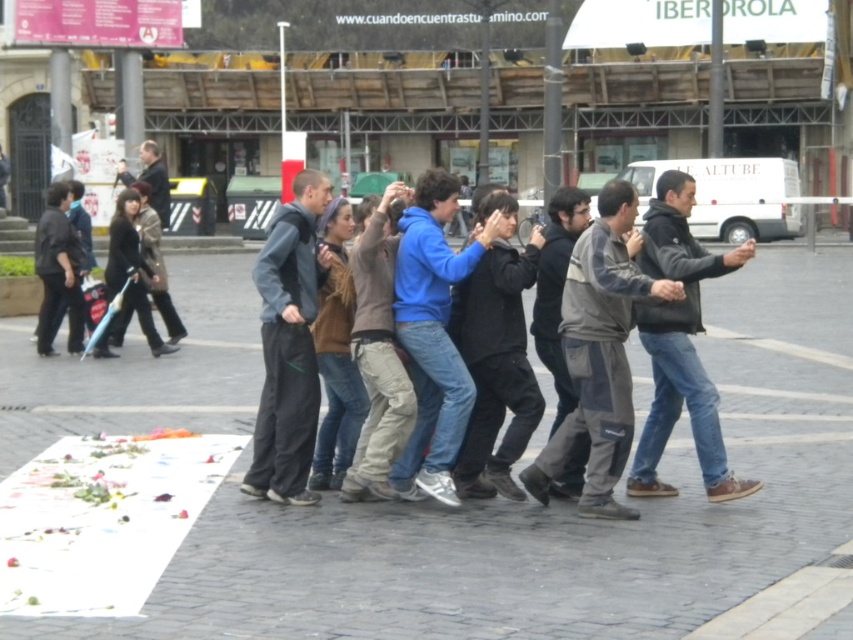
Question: Does cobblestone pavement at center have a lesser width compared to gray fabric jacket at center?

Choices:
 (A) yes
 (B) no

Answer: (B)

Question: Observing the image, what is the correct spatial positioning of cobblestone pavement at center in reference to dark gray hoodie at center?

Choices:
 (A) below
 (B) above

Answer: (B)

Question: Which of the following is the closest to the observer?

Choices:
 (A) dark gray hoodie at center
 (B) dark gray pants at center
 (C) dark brown leather jacket at left
 (D) brown cotton hoodie at center

Answer: (A)

Question: Which object is farther from the camera taking this photo?

Choices:
 (A) cobblestone pavement at center
 (B) black matte jacket at center
 (C) blue fleece jacket at center
 (D) brown cotton hoodie at center

Answer: (B)

Question: Which of the following is the farthest from the observer?

Choices:
 (A) (291, 321)
 (B) (509, 458)

Answer: (B)

Question: Where is cobblestone pavement at center located in relation to dark brown leather jacket at left in the image?

Choices:
 (A) above
 (B) below

Answer: (B)